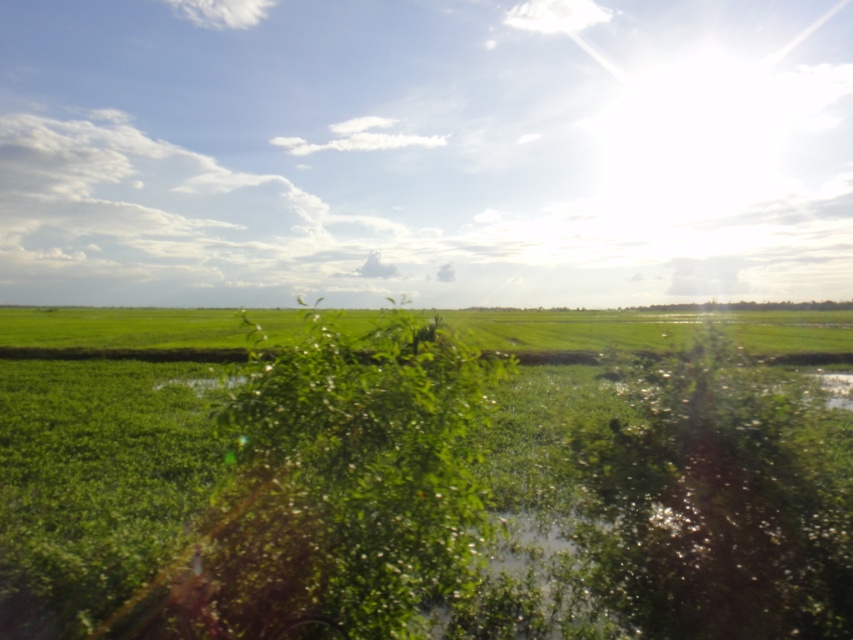
Does green grassy wetland at center appear under green grass at center?

Indeed, green grassy wetland at center is positioned under green grass at center.

Is green grassy wetland at center positioned at the back of green grass at center?

No.

Between point (16, 618) and point (618, 337), which one is positioned in front?

Point (16, 618)

Find the location of `green grassy wetland at center`. green grassy wetland at center is located at coordinates click(x=428, y=493).

How distant is green leafy plant at center from green grass at center?

green leafy plant at center is 53.29 meters from green grass at center.

Between green leafy plant at center and green grass at center, which one has more height?

Standing taller between the two is green grass at center.

Locate an element on the screen. This screenshot has height=640, width=853. green leafy plant at center is located at coordinates (720, 502).

This screenshot has height=640, width=853. Describe the element at coordinates (428, 493) in the screenshot. I see `green grassy wetland at center` at that location.

Can you confirm if green grassy wetland at center is shorter than green leafy plant at center?

In fact, green grassy wetland at center may be taller than green leafy plant at center.

At what (x,y) coordinates should I click in order to perform the action: click on green grassy wetland at center. Please return your answer as a coordinate pair (x, y). Looking at the image, I should click on (428, 493).